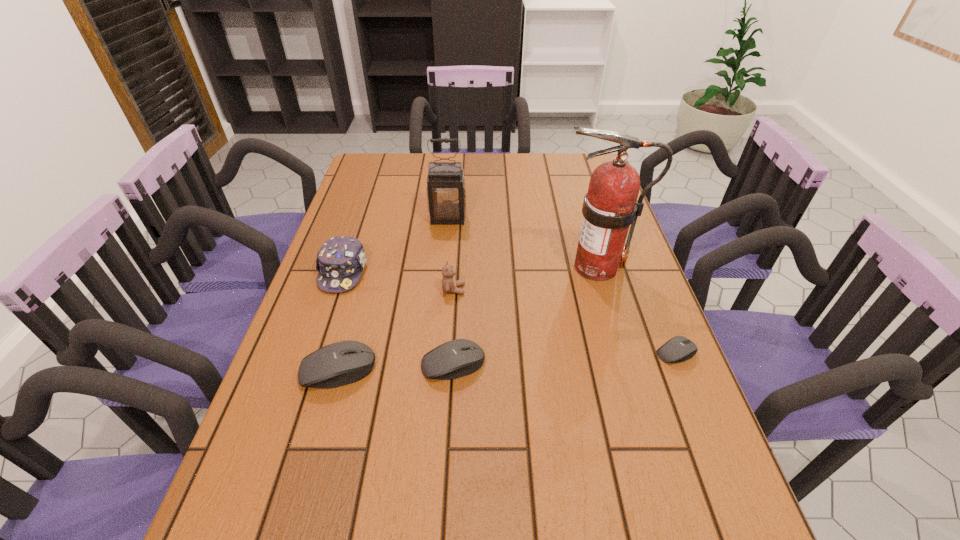
At what (x,y) coordinates should I click in order to perform the action: click on free space that is in between the second tallest computer equipment and the teddy bear. Please return your answer as a coordinate pair (x, y). Looking at the image, I should click on (453, 327).

This screenshot has width=960, height=540. Identify the location of free space between the teddy bear and the sixth shortest object. pos(451,254).

This screenshot has width=960, height=540. In order to click on vacant space that's between the shortest object and the leftmost computer equipment in this screenshot , I will do pyautogui.click(x=507, y=361).

Identify the location of free space between the second tallest object and the leftmost computer equipment. (393, 294).

You are a GUI agent. You are given a task and a screenshot of the screen. Output one action in this format:
    pyautogui.click(x=<x>, y=<y>)
    Task: Click on the vacant space that's between the second shortest object and the fire extinguisher
    The height and width of the screenshot is (540, 960).
    Given the screenshot: What is the action you would take?
    pyautogui.click(x=525, y=315)

Locate an element on the screen. The image size is (960, 540). vacant area between the fire extinguisher and the headwear is located at coordinates (469, 269).

Where is `free space that is in between the rightmost computer equipment and the teddy bear`? free space that is in between the rightmost computer equipment and the teddy bear is located at coordinates (565, 321).

You are a GUI agent. You are given a task and a screenshot of the screen. Output one action in this format:
    pyautogui.click(x=<x>, y=<y>)
    Task: Click on the blank region between the teddy bear and the rightmost computer equipment
    This screenshot has width=960, height=540.
    Given the screenshot: What is the action you would take?
    pyautogui.click(x=565, y=321)

Where is `free space between the headwear and the leftmost computer equipment`? This screenshot has width=960, height=540. free space between the headwear and the leftmost computer equipment is located at coordinates (340, 321).

At what (x,y) coordinates should I click in order to perform the action: click on free space between the fire extinguisher and the teddy bear. Please return your answer as a coordinate pair (x, y). The height and width of the screenshot is (540, 960). Looking at the image, I should click on (525, 278).